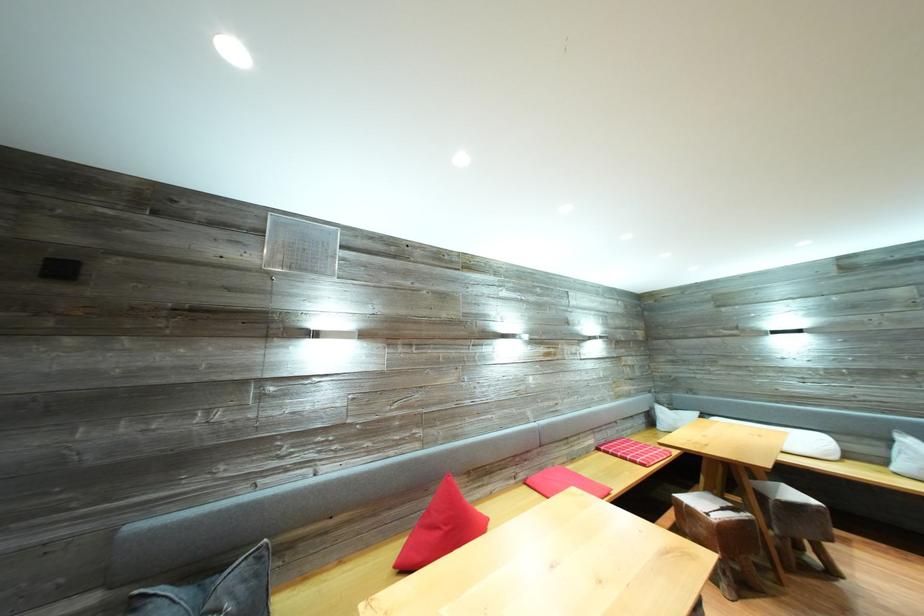
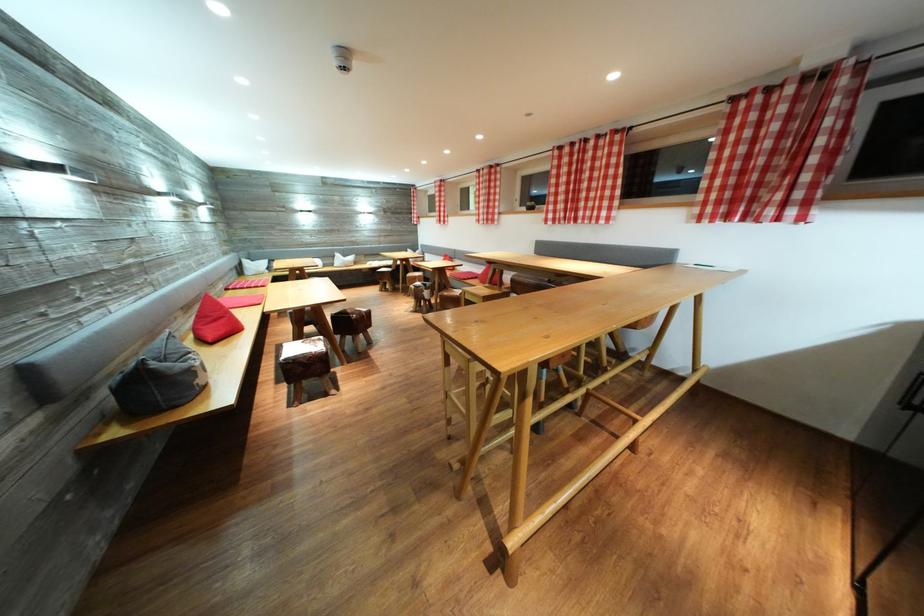
Locate, in the second image, the point that corresponds to point 666,432 in the first image.

(254, 278)